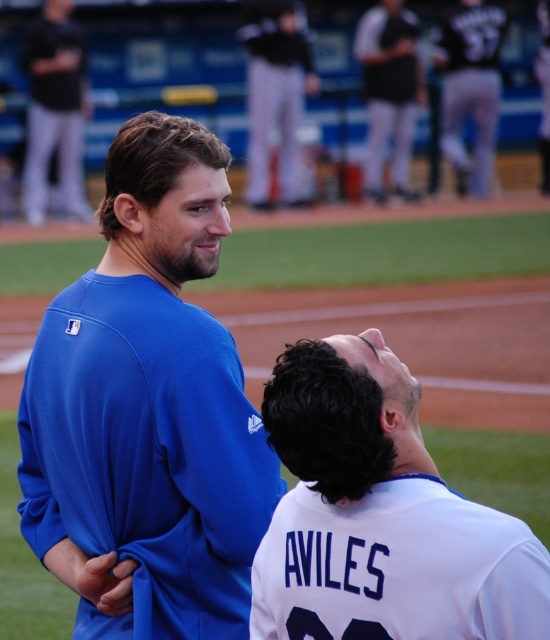
Looking at this image, which is more to the right, black matte pants at upper left or matte blue jersey at upper center?

matte blue jersey at upper center

You are a GUI agent. You are given a task and a screenshot of the screen. Output one action in this format:
    pyautogui.click(x=<x>, y=<y>)
    Task: Click on the black matte pants at upper left
    
    Given the screenshot: What is the action you would take?
    pyautogui.click(x=55, y=112)

Locate an element on the screen. The image size is (550, 640). black matte pants at upper left is located at coordinates (55, 112).

Between matte blue jersey at center and matte blue jersey at upper center, which one has less height?

With less height is matte blue jersey at center.

Is point (155, 472) in front of point (541, 193)?

Yes, point (155, 472) is in front of point (541, 193).

Does point (114, 426) lie behind point (546, 26)?

That is False.

Image resolution: width=550 pixels, height=640 pixels. Find the location of `matte blue jersey at center`. matte blue jersey at center is located at coordinates (147, 410).

Is black jersey at upper right wider than black jersey at upper center?

Correct, the width of black jersey at upper right exceeds that of black jersey at upper center.

Does black jersey at upper right have a greater height compared to black jersey at upper center?

In fact, black jersey at upper right may be shorter than black jersey at upper center.

Which is in front, point (462, 88) or point (375, 104)?

Positioned in front is point (375, 104).

You are a GUI agent. You are given a task and a screenshot of the screen. Output one action in this format:
    pyautogui.click(x=<x>, y=<y>)
    Task: Click on the black jersey at upper right
    The height and width of the screenshot is (640, 550).
    Given the screenshot: What is the action you would take?
    pyautogui.click(x=470, y=92)